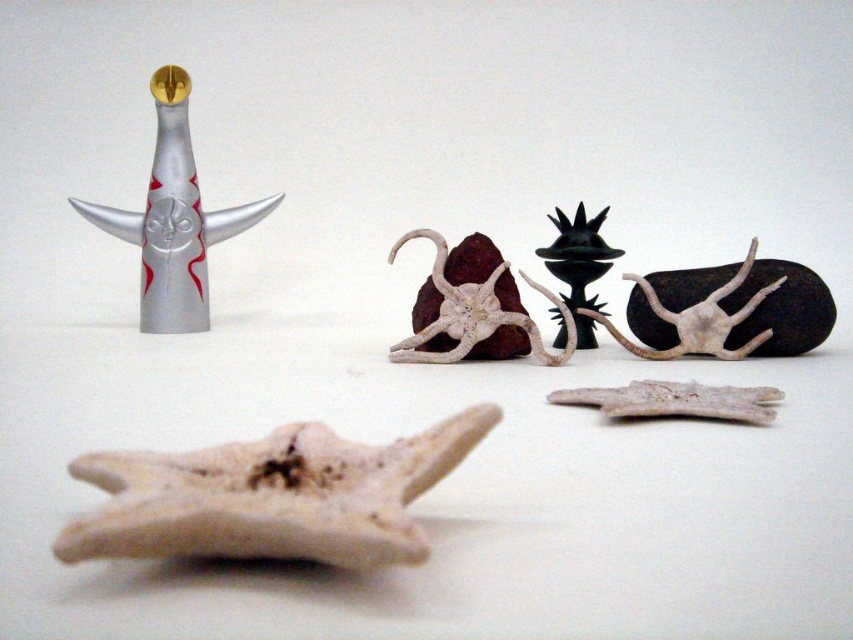
You are an art curator arranging an exhibition and need to place a small decorative item between the transparent glass figurine at upper left and the white matte starfish at center. Based on their positions, which object should the item be closer to?

The transparent glass figurine at upper left is closer to the viewer than the white matte starfish at center, so the item should be placed closer to the white matte starfish at center to maintain visual balance.

You are an art curator arranging items on a display table. You have the white matte bone at center and the white matte starfish at center. Based on their positions, which object is closer to the bottom edge of the table?

The white matte bone at center is closer to the bottom edge of the table because it is positioned below the white matte starfish at center.

You are an artist arranging objects on a white surface. You have a white matte bone at center and a white matte starfish at center. According to the arrangement, which object is positioned to the left?

The white matte bone at center is positioned to the left of the white matte starfish at center.